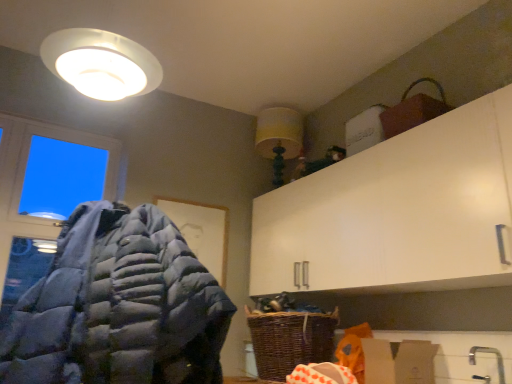
Question: Can you confirm if woven brown basket at lower center is smaller than gray down jacket at left?

Choices:
 (A) yes
 (B) no

Answer: (A)

Question: From the image's perspective, does woven brown basket at lower center appear higher than gray down jacket at left?

Choices:
 (A) no
 (B) yes

Answer: (A)

Question: Is woven brown basket at lower center aimed at gray down jacket at left?

Choices:
 (A) no
 (B) yes

Answer: (B)

Question: Is woven brown basket at lower center closer to the viewer compared to gray down jacket at left?

Choices:
 (A) yes
 (B) no

Answer: (B)

Question: Is gray down jacket at left located within woven brown basket at lower center?

Choices:
 (A) no
 (B) yes

Answer: (A)

Question: Relative to gray down jacket at left, is yellow fabric lampshade at upper center in front or behind?

Choices:
 (A) front
 (B) behind

Answer: (B)

Question: Is yellow fabric lampshade at upper center taller or shorter than gray down jacket at left?

Choices:
 (A) short
 (B) tall

Answer: (A)

Question: In terms of size, does yellow fabric lampshade at upper center appear bigger or smaller than gray down jacket at left?

Choices:
 (A) small
 (B) big

Answer: (A)

Question: From the image's perspective, relative to gray down jacket at left, is yellow fabric lampshade at upper center above or below?

Choices:
 (A) above
 (B) below

Answer: (A)

Question: Which is correct: transparent glass window at upper left is inside brown cardboard box at lower right, or outside of it?

Choices:
 (A) outside
 (B) inside

Answer: (A)

Question: From a real-world perspective, is transparent glass window at upper left above or below brown cardboard box at lower right?

Choices:
 (A) above
 (B) below

Answer: (A)

Question: Considering the positions of transparent glass window at upper left and brown cardboard box at lower right in the image, is transparent glass window at upper left wider or thinner than brown cardboard box at lower right?

Choices:
 (A) thin
 (B) wide

Answer: (A)

Question: Considering the positions of point (76, 139) and point (411, 365), is point (76, 139) closer or farther from the camera than point (411, 365)?

Choices:
 (A) closer
 (B) farther

Answer: (B)

Question: Is brown cardboard box at lower right taller or shorter than transparent glass window at upper left?

Choices:
 (A) short
 (B) tall

Answer: (A)

Question: Is point (394, 380) positioned closer to the camera than point (68, 211)?

Choices:
 (A) farther
 (B) closer

Answer: (B)